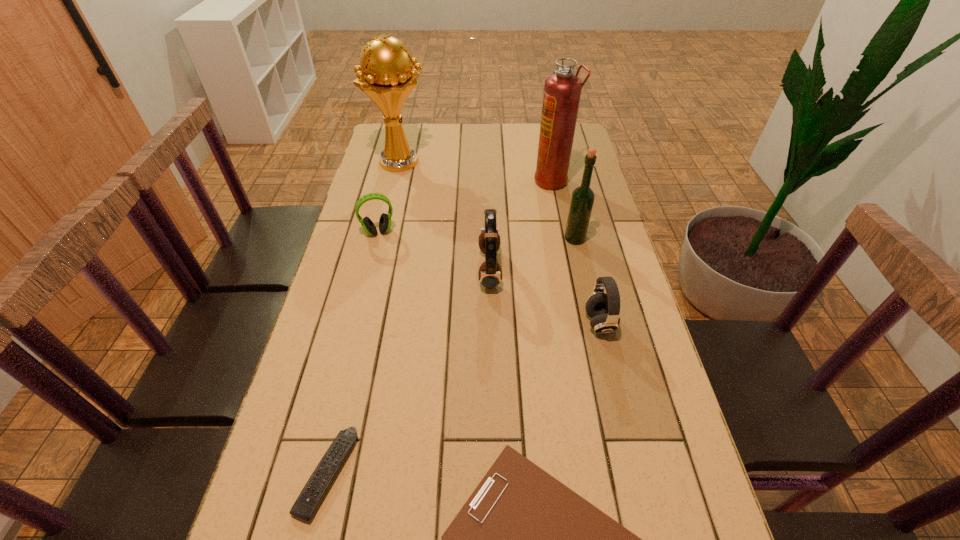
You are a GUI agent. You are given a task and a screenshot of the screen. Output one action in this format:
    pyautogui.click(x=<x>, y=<y>)
    Task: Click on the free space at the far edge of the desktop
    This screenshot has height=540, width=960.
    Given the screenshot: What is the action you would take?
    pyautogui.click(x=485, y=147)

The image size is (960, 540). Identify the location of vacant space at the left edge. (390, 254).

In the image, there is a desktop. At what (x,y) coordinates should I click in order to perform the action: click on vacant space at the right edge. Please return your answer as a coordinate pair (x, y). The height and width of the screenshot is (540, 960). Looking at the image, I should click on (x=638, y=382).

I want to click on free space between the remote control and the trophy_cup, so click(364, 317).

At what (x,y) coordinates should I click in order to perform the action: click on vacant space that's between the fire extinguisher and the second shortest object. Please return your answer as a coordinate pair (x, y). The image size is (960, 540). Looking at the image, I should click on (440, 327).

Find the location of `free space between the seventh tallest object and the farthest headset`. free space between the seventh tallest object and the farthest headset is located at coordinates (353, 353).

The width and height of the screenshot is (960, 540). Identify the location of unoccupied position between the remote control and the leftmost headset. (353, 353).

At what (x,y) coordinates should I click in order to perform the action: click on vacant point located between the fire extinguisher and the second headset from left to right. Please return your answer as a coordinate pair (x, y). The width and height of the screenshot is (960, 540). Looking at the image, I should click on (521, 225).

What are the coordinates of `free point between the second headset from left to right and the farthest headset` in the screenshot? It's located at (434, 251).

Identify the location of vacant area between the remote control and the farthest headset. (353, 353).